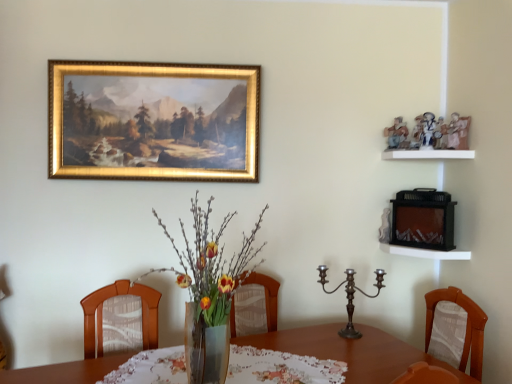
Question: From the image's perspective, would you say printed fabric tablecloth at center is shown under gold-framed painting at upper center?

Choices:
 (A) no
 (B) yes

Answer: (B)

Question: Is printed fabric tablecloth at center taller than gold-framed painting at upper center?

Choices:
 (A) no
 (B) yes

Answer: (A)

Question: Can you confirm if printed fabric tablecloth at center is positioned to the right of gold-framed painting at upper center?

Choices:
 (A) yes
 (B) no

Answer: (A)

Question: From the image's perspective, would you say printed fabric tablecloth at center is positioned over gold-framed painting at upper center?

Choices:
 (A) yes
 (B) no

Answer: (B)

Question: Is printed fabric tablecloth at center thinner than gold-framed painting at upper center?

Choices:
 (A) yes
 (B) no

Answer: (B)

Question: Do you think polished bronze candelabra at center is within printed fabric tablecloth at center, or outside of it?

Choices:
 (A) inside
 (B) outside

Answer: (B)

Question: Is polished bronze candelabra at center wider or thinner than printed fabric tablecloth at center?

Choices:
 (A) thin
 (B) wide

Answer: (A)

Question: In the image, is polished bronze candelabra at center positioned in front of or behind printed fabric tablecloth at center?

Choices:
 (A) front
 (B) behind

Answer: (B)

Question: Does point pos(356,334) appear closer or farther from the camera than point pos(342,375)?

Choices:
 (A) farther
 (B) closer

Answer: (A)

Question: Is white matte shelf at upper right, positioned as the 1th shelf in top-to-bottom order, bigger or smaller than polished bronze candelabra at center?

Choices:
 (A) big
 (B) small

Answer: (B)

Question: From a real-world perspective, is white matte shelf at upper right, positioned as the 1th shelf in top-to-bottom order, above or below polished bronze candelabra at center?

Choices:
 (A) below
 (B) above

Answer: (B)

Question: Considering the relative positions of white matte shelf at upper right, the 2th shelf when ordered from bottom to top, and polished bronze candelabra at center in the image provided, is white matte shelf at upper right, the 2th shelf when ordered from bottom to top, to the left or to the right of polished bronze candelabra at center?

Choices:
 (A) left
 (B) right

Answer: (B)

Question: Is white matte shelf at upper right, positioned as the 1th shelf in top-to-bottom order, taller or shorter than polished bronze candelabra at center?

Choices:
 (A) tall
 (B) short

Answer: (B)

Question: From the image's perspective, is translucent glass vase at center above or below gold-framed painting at upper center?

Choices:
 (A) below
 (B) above

Answer: (A)

Question: In terms of size, does translucent glass vase at center appear bigger or smaller than gold-framed painting at upper center?

Choices:
 (A) big
 (B) small

Answer: (A)